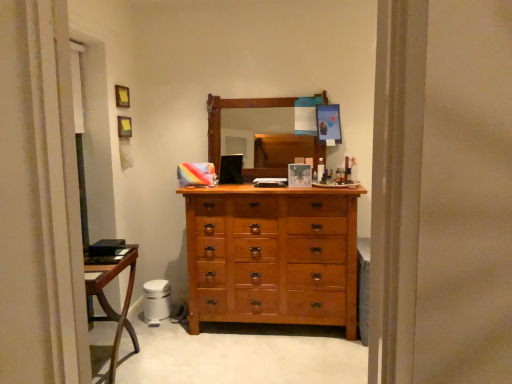
Image resolution: width=512 pixels, height=384 pixels. What do you see at coordinates (272, 255) in the screenshot?
I see `light brown wood dresser at center` at bounding box center [272, 255].

In order to click on light brown wood dresser at center in this screenshot , I will do `click(272, 255)`.

Identify the location of light brown wood dresser at center. Image resolution: width=512 pixels, height=384 pixels. (272, 255).